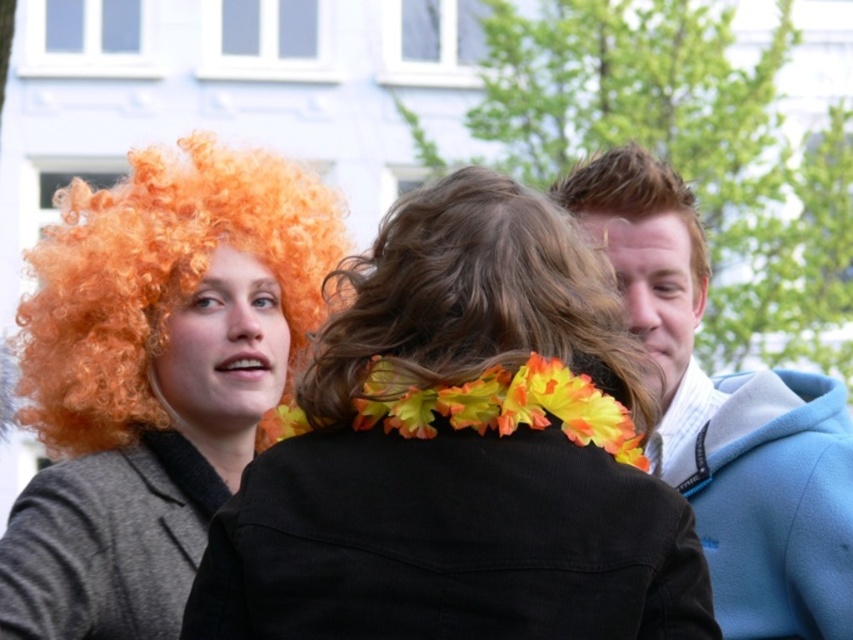
Does point (256, 506) come farther from viewer compared to point (616, 182)?

No, (256, 506) is closer to viewer.

Is curly orange wig at left to the right of slick brown hair at upper right from the viewer's perspective?

Incorrect, curly orange wig at left is not on the right side of slick brown hair at upper right.

You are a GUI agent. You are given a task and a screenshot of the screen. Output one action in this format:
    pyautogui.click(x=<x>, y=<y>)
    Task: Click on the curly orange wig at left
    
    Given the screenshot: What is the action you would take?
    pyautogui.click(x=459, y=456)

Who is more forward, (350, 326) or (663, 432)?

Point (350, 326) is more forward.

Is curly orange wig at left shorter than light blue fleece jacket at right?

Yes, curly orange wig at left is shorter than light blue fleece jacket at right.

I want to click on curly orange wig at left, so click(x=459, y=456).

At what (x,y) coordinates should I click in order to perform the action: click on curly orange wig at left. Please return your answer as a coordinate pair (x, y). The width and height of the screenshot is (853, 640). Looking at the image, I should click on (459, 456).

What do you see at coordinates (728, 417) in the screenshot? The height and width of the screenshot is (640, 853). I see `light blue fleece jacket at right` at bounding box center [728, 417].

Is light blue fleece jacket at right smaller than dark brown curly hair at center?

Actually, light blue fleece jacket at right might be larger than dark brown curly hair at center.

Describe the element at coordinates (728, 417) in the screenshot. I see `light blue fleece jacket at right` at that location.

Where is `light blue fleece jacket at right`? This screenshot has width=853, height=640. light blue fleece jacket at right is located at coordinates (728, 417).